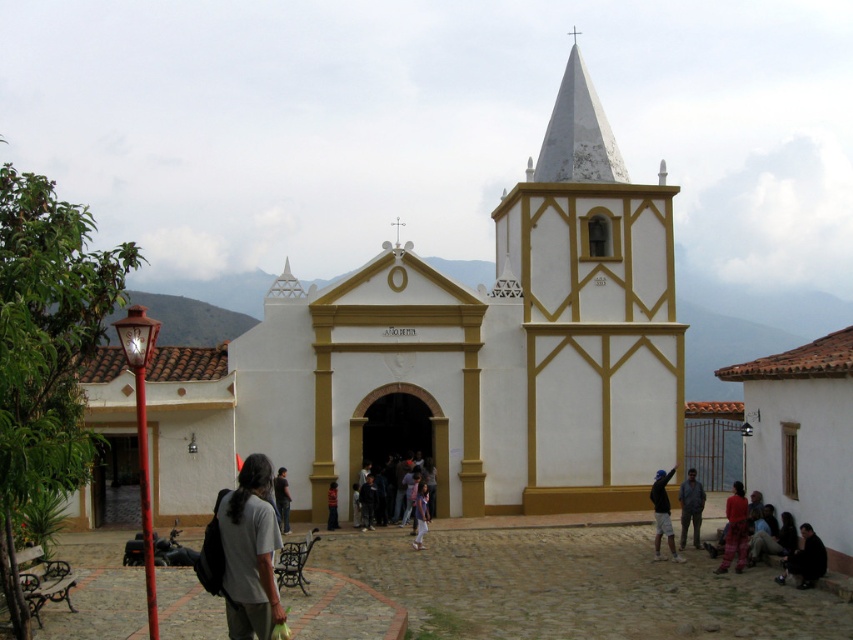
You are standing in the plaza in front of the church and notice the white matte spire at upper center and the light brown leather shoes at center. Which object is higher from the ground?

The white matte spire at upper center is located above the light brown leather shoes at center, so it is higher from the ground.

You are standing at the entrance of the church and want to reach the point marked as point (294, 298). However, there is an obstacle at point (361, 490). Can you walk directly to your destination without going around the obstacle?

Point (294, 298) is behind point (361, 490), so you cannot walk directly to the destination without going around the obstacle.

Based on the photo, you are standing in the plaza in front of the colonial church. You notice two points marked in the scene. The first point is at coordinate point[724,556] and the second is at point[366,488]. If you want to walk from the first point to the second point, will you be moving towards the church or away from it?

Since point[724,556] is in front of point[366,488], walking from the first point to the second point means moving away from the church.